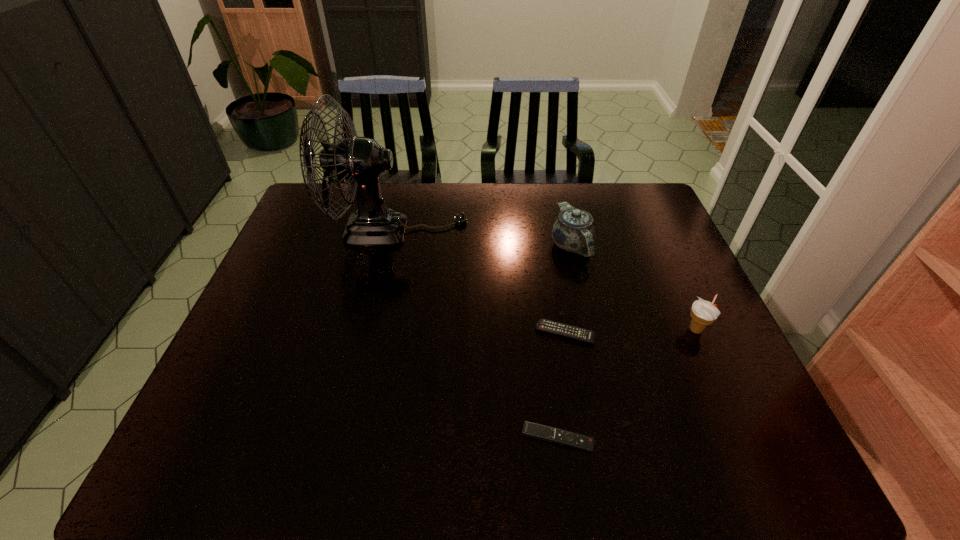
Where is `fan`? The height and width of the screenshot is (540, 960). fan is located at coordinates (360, 160).

This screenshot has height=540, width=960. In order to click on the tallest object in this screenshot , I will do `click(360, 160)`.

In order to click on chinaware in this screenshot , I will do point(573,231).

Find the location of a particular element. This screenshot has height=540, width=960. the rightmost object is located at coordinates (703, 313).

The width and height of the screenshot is (960, 540). I want to click on the farther remote control, so click(x=545, y=325).

Locate an element on the screen. Image resolution: width=960 pixels, height=540 pixels. the nearer remote control is located at coordinates (538, 431).

The height and width of the screenshot is (540, 960). I want to click on vacant space situated 0.390m in front of the fan, indicating the direction of air flow, so click(x=590, y=231).

Image resolution: width=960 pixels, height=540 pixels. I want to click on blank space located 0.220m from the spout of the chinaware, so click(590, 326).

Locate an element on the screen. The width and height of the screenshot is (960, 540). free space located on the left of the icecream is located at coordinates (628, 330).

You are a GUI agent. You are given a task and a screenshot of the screen. Output one action in this format:
    pyautogui.click(x=<x>, y=<y>)
    Task: Click on the vacant region located 0.070m on the front of the farther remote control
    This screenshot has width=960, height=540.
    Given the screenshot: What is the action you would take?
    pyautogui.click(x=572, y=370)